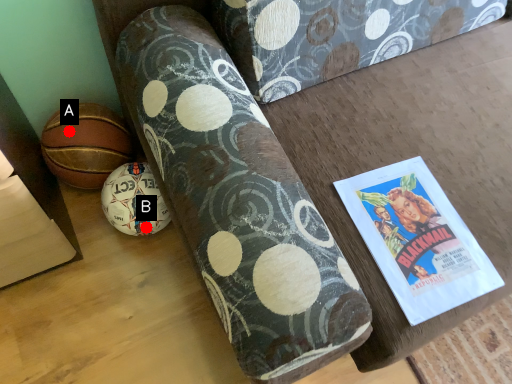
Question: Two points are circled on the image, labeled by A and B beside each circle. Among these points, which one is farthest from the camera?

Choices:
 (A) A is further
 (B) B is further

Answer: (B)